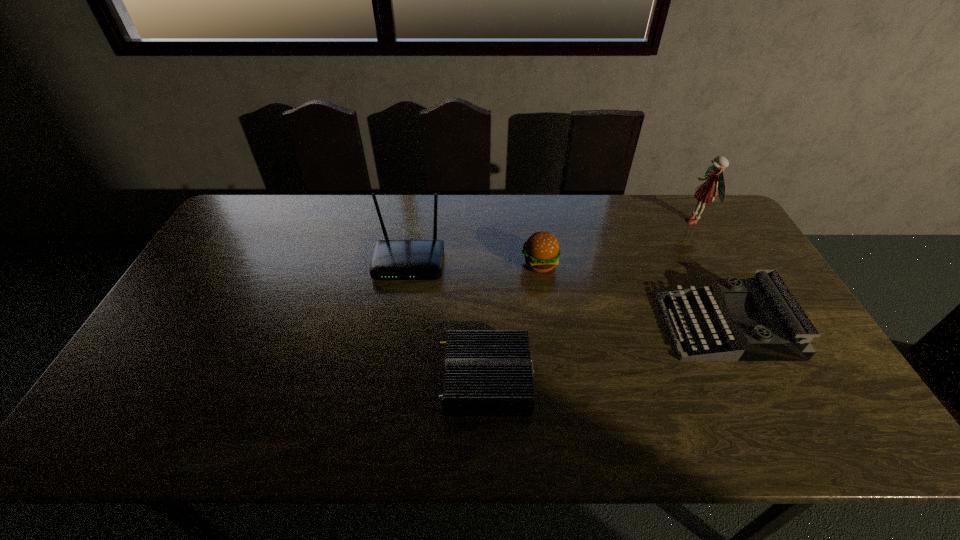
Point out which object is positioned as the second nearest to the hamburger. Please provide its 2D coordinates. Your answer should be formatted as a tuple, i.e. [(x, y)], where the tuple contains the x and y coordinates of a point satisfying the conditions above.

[(487, 372)]

Locate an element on the screen. vacant point that satisfies the following two spatial constraints: 1. on the front-facing side of the farthest object; 2. on the front side of the hamburger is located at coordinates (719, 264).

Identify the location of vacant space that satisfies the following two spatial constraints: 1. on the front-facing side of the hamburger; 2. on the right side of the leftmost object. (409, 264).

You are a GUI agent. You are given a task and a screenshot of the screen. Output one action in this format:
    pyautogui.click(x=<x>, y=<y>)
    Task: Click on the free space that satisfies the following two spatial constraints: 1. on the front-facing side of the farthest object; 2. on the front-facing side of the taller router
    
    Given the screenshot: What is the action you would take?
    pyautogui.click(x=718, y=264)

You are a GUI agent. You are given a task and a screenshot of the screen. Output one action in this format:
    pyautogui.click(x=<x>, y=<y>)
    Task: Click on the free space that satisfies the following two spatial constraints: 1. on the front-facing side of the farthest object; 2. on the front-facing side of the taller router
    Image resolution: width=960 pixels, height=540 pixels.
    Given the screenshot: What is the action you would take?
    pyautogui.click(x=718, y=264)